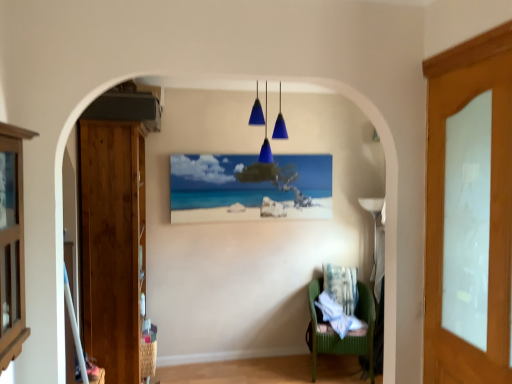
Locate an element on the screen. The image size is (512, 384). vacant space in green fabric chair at lower right (from a real-world perspective) is located at coordinates pyautogui.click(x=338, y=372).